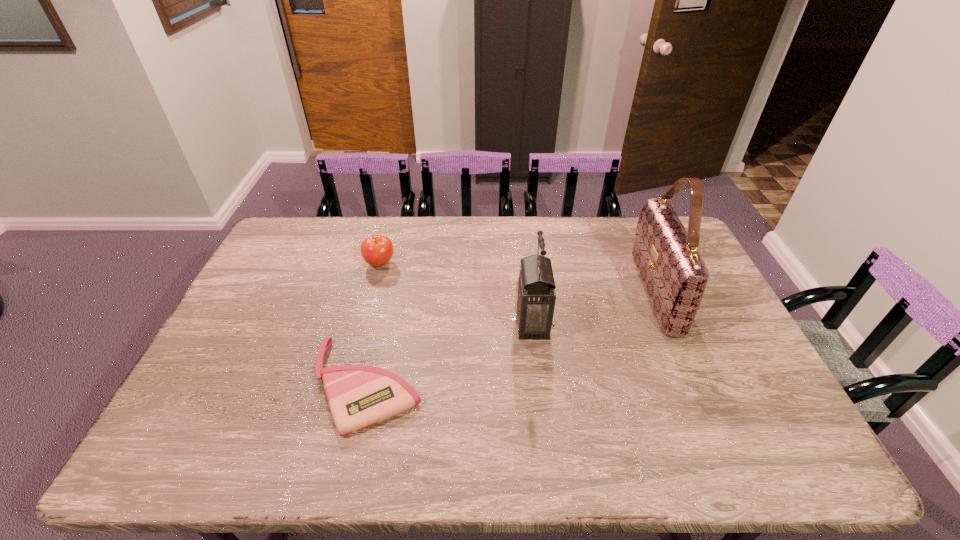
Where is `handbag`? handbag is located at coordinates (675, 276).

At what (x,y) coordinates should I click in order to perform the action: click on the rightmost object. Please return your answer as a coordinate pair (x, y). This screenshot has height=540, width=960. Looking at the image, I should click on (675, 276).

You are a GUI agent. You are given a task and a screenshot of the screen. Output one action in this format:
    pyautogui.click(x=<x>, y=<y>)
    Task: Click on the second tallest object
    
    Given the screenshot: What is the action you would take?
    pyautogui.click(x=535, y=298)

Find the location of a particular element. the third object from left to right is located at coordinates (535, 298).

Locate an element on the screen. The image size is (960, 540). apple is located at coordinates (377, 250).

The image size is (960, 540). Identify the location of the shortest object. (359, 396).

Where is `vacant space located on the front of the tallest object with the clasp`? vacant space located on the front of the tallest object with the clasp is located at coordinates (559, 292).

Locate an element on the screen. vacant position located on the front of the tallest object with the clasp is located at coordinates (609, 292).

Where is `vacant area situated 0.100m on the front of the tallest object with the clasp`? vacant area situated 0.100m on the front of the tallest object with the clasp is located at coordinates (609, 292).

Locate an element on the screen. vacant space located 0.390m on the front-facing side of the second tallest object is located at coordinates (383, 324).